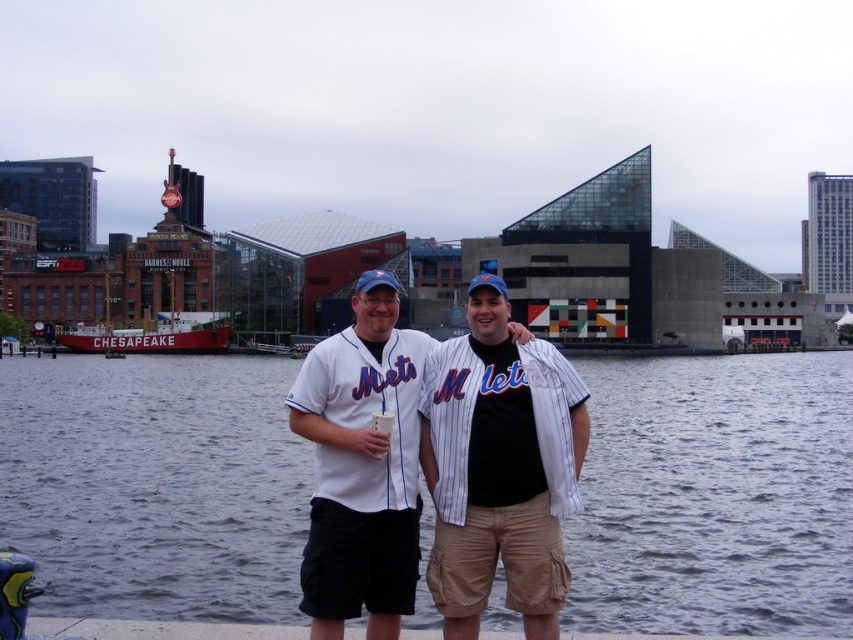
Looking at this image, you are a photographer trying to capture a group photo of the two Mets fans. The white pinstriped baseball uniform at center and the white wooden boat at left are both in the frame. Since you want to ensure that the uniform is not too small compared to the boat, which object should you move closer to the camera to maintain their proportional sizes?

Since the white pinstriped baseball uniform at center is narrower than the white wooden boat at left, to maintain proportional sizes, you should move the white pinstriped baseball uniform at center closer to the camera. This will make it appear larger in the photo relative to the boat.

You are a photographer trying to capture a photo of the white pinstriped baseball uniform at center and the white wooden boat at left. Which object is closer to the camera?

The white pinstriped baseball uniform at center is positioned under the white wooden boat at left, meaning it is closer to the camera.